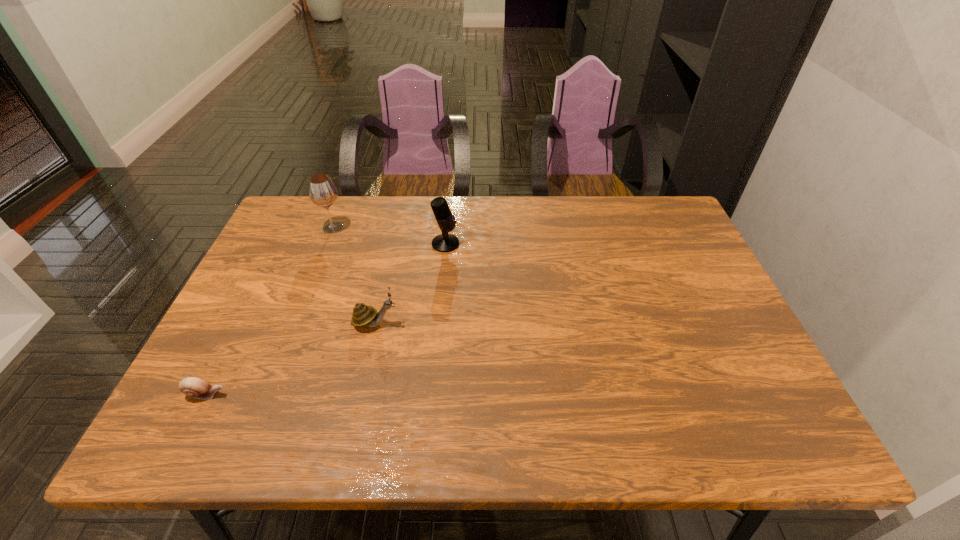
What are the coordinates of `vacant space that's between the nearest object and the microphone` in the screenshot? It's located at (325, 319).

Locate an element on the screen. The image size is (960, 540). unoccupied position between the microphone and the wineglass is located at coordinates (389, 235).

I want to click on object identified as the third closest to the rightmost object, so click(x=194, y=387).

Select which object appears as the closest to the third tallest object. Please provide its 2D coordinates. Your answer should be formatted as a tuple, i.e. [(x, y)], where the tuple contains the x and y coordinates of a point satisfying the conditions above.

[(445, 242)]

Locate an element on the screen. free space that satisfies the following two spatial constraints: 1. on the front side of the wineglass; 2. on the front-facing side of the nearer escargot is located at coordinates (268, 394).

This screenshot has height=540, width=960. What are the coordinates of `blank area in the image that satisfies the following two spatial constraints: 1. on the front side of the second object from left to right; 2. on the front-facing side of the nearest object` in the screenshot? It's located at (268, 394).